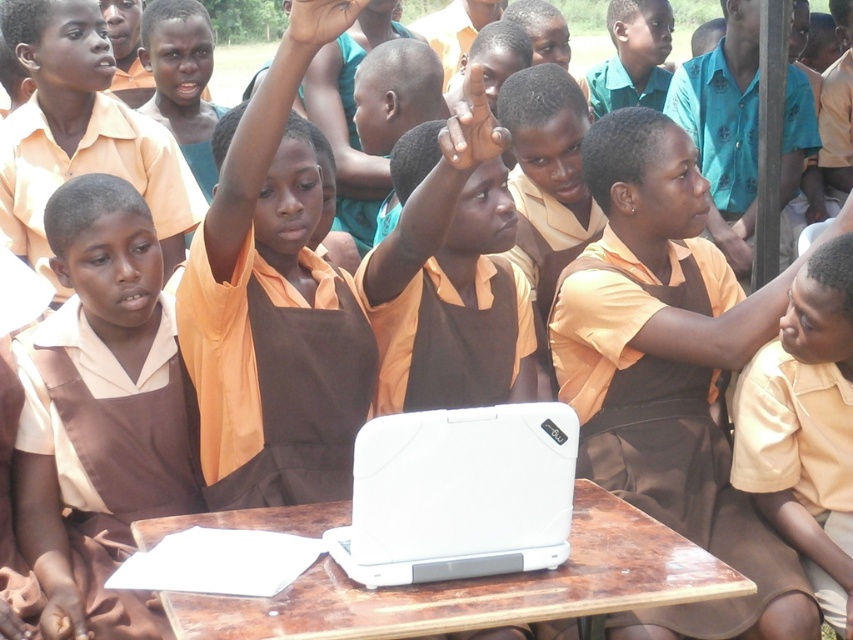
Question: Can you confirm if brown matte uniform at center is positioned below white matte table at center?

Choices:
 (A) yes
 (B) no

Answer: (B)

Question: Based on their relative distances, which object is nearer to the orange matte shirt at upper center?

Choices:
 (A) green matte shirt at upper center
 (B) white plastic laptop at center
 (C) brown matte uniform at center

Answer: (B)

Question: Among these points, which one is farthest from the camera?

Choices:
 (A) (843, 490)
 (B) (59, 362)
 (C) (599, 96)
 (D) (483, 557)

Answer: (C)

Question: Is white matte table at center positioned at the back of orange matte shirt at upper center?

Choices:
 (A) no
 (B) yes

Answer: (A)

Question: From the image, what is the correct spatial relationship of orange matte shirt at upper center in relation to green matte shirt at upper center?

Choices:
 (A) below
 (B) above

Answer: (A)

Question: Which point is farther from the camera taking this photo?

Choices:
 (A) (207, 522)
 (B) (392, 538)

Answer: (A)